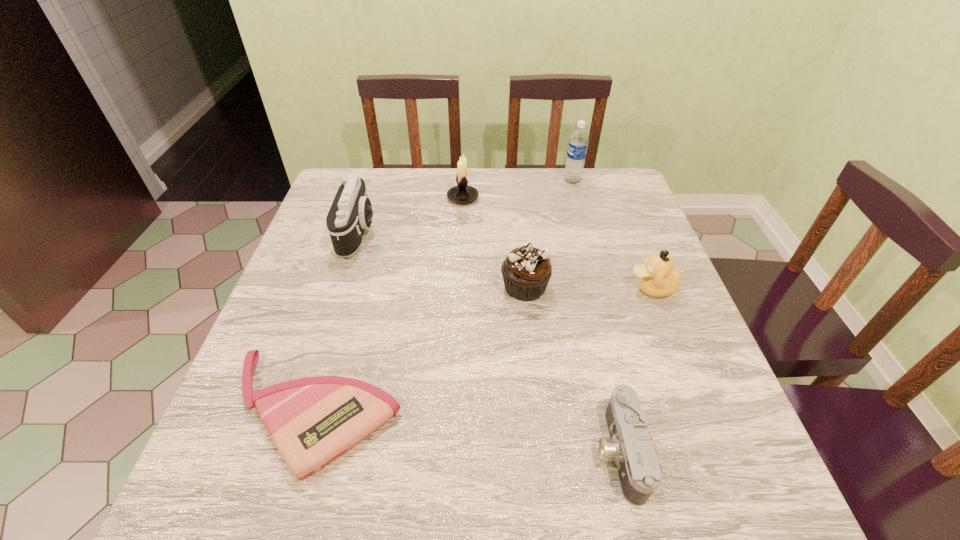
Where is `free region located on the back of the wristlet`? The width and height of the screenshot is (960, 540). free region located on the back of the wristlet is located at coordinates (346, 306).

In order to click on water bottle located in the far edge section of the desktop in this screenshot , I will do `click(578, 143)`.

I want to click on candle holder at the far edge, so click(x=462, y=193).

You are a GUI agent. You are given a task and a screenshot of the screen. Output one action in this format:
    pyautogui.click(x=<x>, y=<y>)
    Task: Click on the camera present at the far edge
    This screenshot has height=540, width=960.
    Given the screenshot: What is the action you would take?
    pyautogui.click(x=351, y=213)

Locate an element on the screen. camera at the near edge is located at coordinates (631, 447).

Identify the location of wristlet that is at the near edge. The width and height of the screenshot is (960, 540). coord(312,421).

Where is `camera located in the left edge section of the desktop`? The image size is (960, 540). camera located in the left edge section of the desktop is located at coordinates pos(351,213).

Identify the location of wristlet that is positioned at the left edge. The height and width of the screenshot is (540, 960). (312, 421).

Where is `water bottle present at the right edge`? water bottle present at the right edge is located at coordinates (578, 143).

At what (x,y) coordinates should I click in order to perform the action: click on duckling positioned at the right edge. Please return your answer as a coordinate pair (x, y). Looking at the image, I should click on (657, 278).